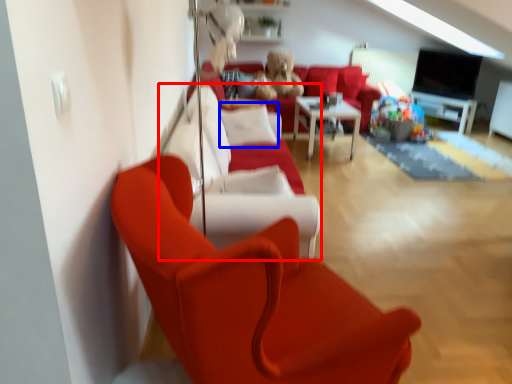
Question: Which object is closer to the camera taking this photo, couch (highlighted by a red box) or pillow (highlighted by a blue box)?

Choices:
 (A) couch
 (B) pillow

Answer: (A)